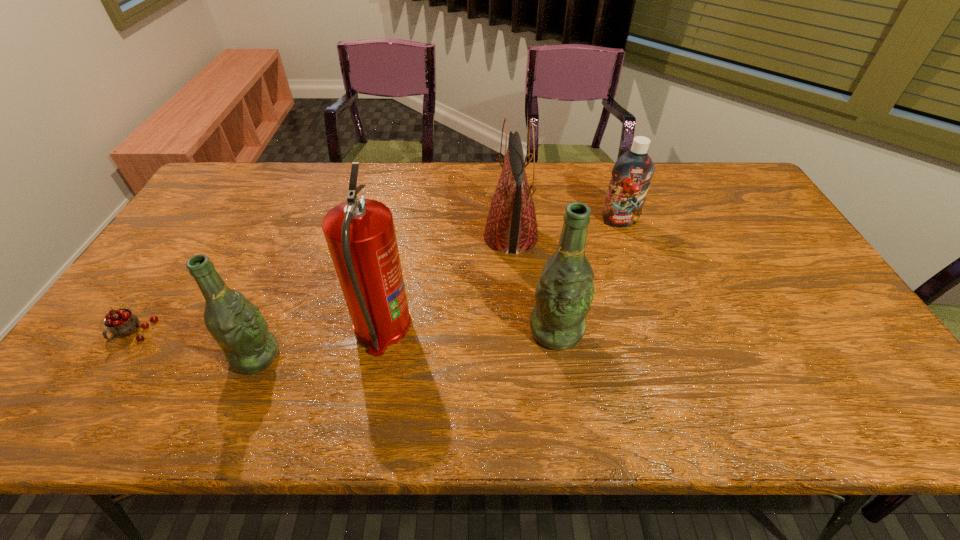
Where is `object identified as the fourth closest to the right beer bottle`? object identified as the fourth closest to the right beer bottle is located at coordinates (237, 325).

Identify the location of vacant region that satisfies the following two spatial constraints: 1. on the instruction side of the fire extinguisher; 2. on the handle side of the cherry. Image resolution: width=960 pixels, height=540 pixels. (381, 333).

Find the location of a particular element. vacant region that satisfies the following two spatial constraints: 1. on the instruction side of the third object from left to right; 2. on the handle side of the shortest object is located at coordinates (381, 333).

Where is `free spot that satisfies the following two spatial constraints: 1. on the surface of the taller beer bottle; 2. on the surface of the shorter beer bottle`? Image resolution: width=960 pixels, height=540 pixels. free spot that satisfies the following two spatial constraints: 1. on the surface of the taller beer bottle; 2. on the surface of the shorter beer bottle is located at coordinates (560, 356).